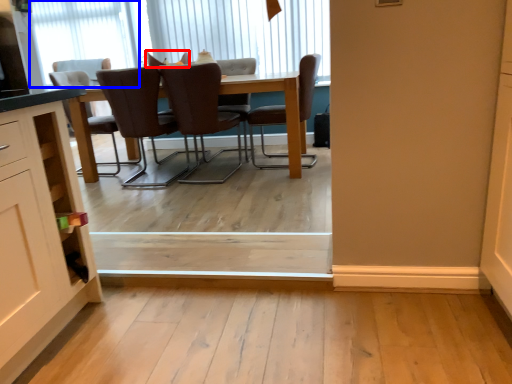
Question: Among these objects, which one is nearest to the camera, chair (highlighted by a red box) or window (highlighted by a blue box)?

Choices:
 (A) chair
 (B) window

Answer: (A)